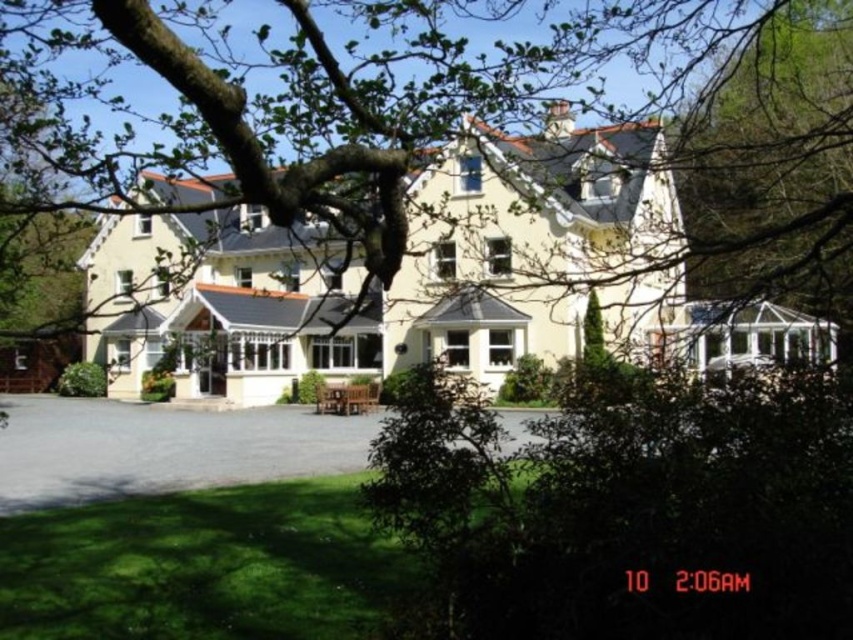
Which is above, yellow matte building at center or gray asphalt driveway at lower center?

yellow matte building at center is higher up.

Is the position of yellow matte building at center more distant than that of gray asphalt driveway at lower center?

No, it is in front of gray asphalt driveway at lower center.

Is point (592, 234) closer to viewer compared to point (148, 474)?

That is False.

You are a GUI agent. You are given a task and a screenshot of the screen. Output one action in this format:
    pyautogui.click(x=<x>, y=<y>)
    Task: Click on the yellow matte building at center
    
    Given the screenshot: What is the action you would take?
    pyautogui.click(x=398, y=272)